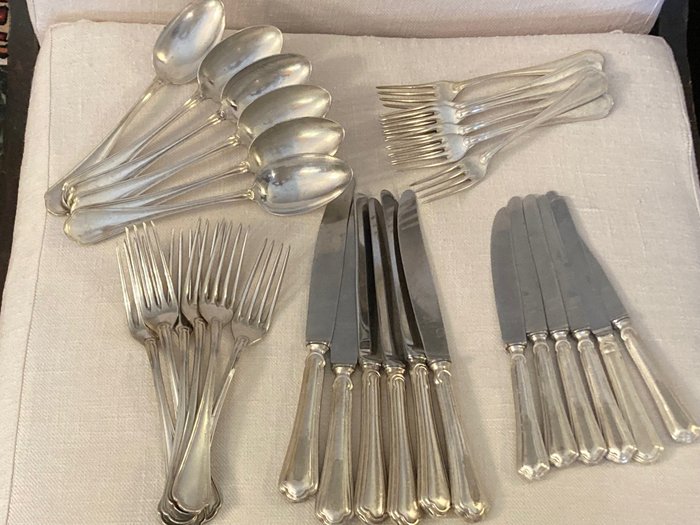
You are a GUI agent. You are given a task and a screenshot of the screen. Output one action in this format:
    pyautogui.click(x=<x>, y=<y>)
    Task: Click on the spoon
    This screenshot has height=525, width=700.
    Given the screenshot: What is the action you would take?
    pyautogui.click(x=190, y=38), pyautogui.click(x=241, y=45), pyautogui.click(x=267, y=71), pyautogui.click(x=284, y=101), pyautogui.click(x=299, y=135), pyautogui.click(x=307, y=181)